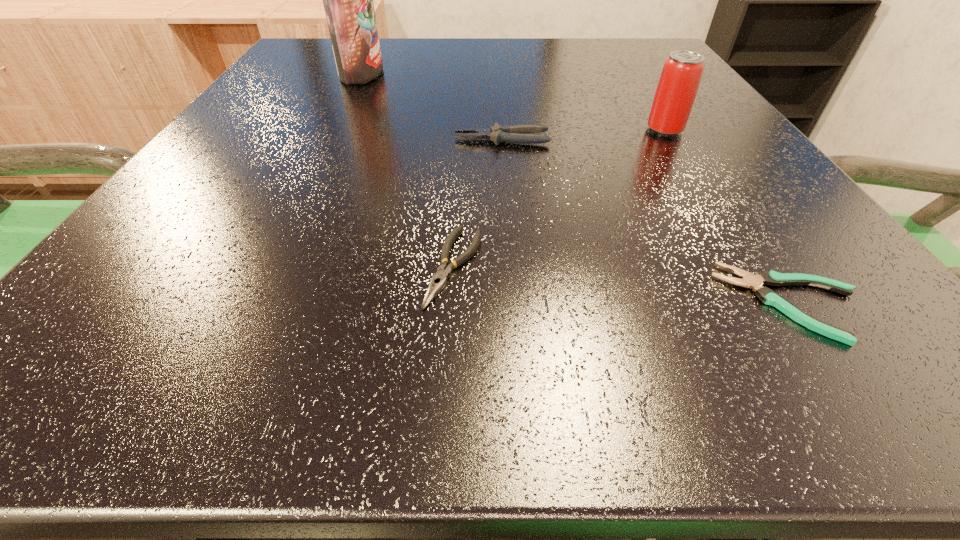
This screenshot has height=540, width=960. In order to click on free region that satisfies the following two spatial constraints: 1. on the front label of the farthest object; 2. on the left side of the second tallest pliers in this screenshot , I will do `click(264, 267)`.

What are the coordinates of `free space that satisfies the following two spatial constraints: 1. on the front label of the shortest object; 2. on the right side of the tallest object` in the screenshot? It's located at (247, 302).

In order to click on free space that satisfies the following two spatial constraints: 1. on the back side of the second shortest object; 2. on the front label of the shampoo in this screenshot , I will do `click(466, 72)`.

The width and height of the screenshot is (960, 540). What are the coordinates of `vacant space that satisfies the following two spatial constraints: 1. at the gripping part of the tallest pliers; 2. on the front side of the second shortest object` in the screenshot? It's located at (512, 267).